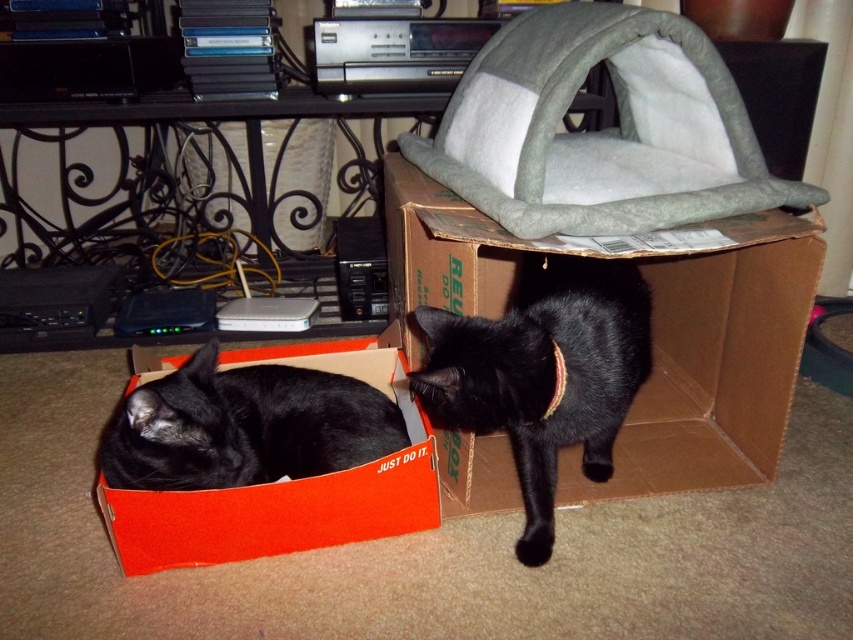
Question: Does cardboard box at center have a greater width compared to black smooth cat at lower left?

Choices:
 (A) yes
 (B) no

Answer: (A)

Question: Which point is closer to the camera?

Choices:
 (A) black smooth cat at lower left
 (B) cardboard box at center

Answer: (A)

Question: Which point appears farthest from the camera in this image?

Choices:
 (A) (425, 326)
 (B) (399, 275)
 (C) (277, 378)

Answer: (B)

Question: Does cardboard box at center come behind black fur cat at center?

Choices:
 (A) yes
 (B) no

Answer: (A)

Question: Can you confirm if black fur cat at center is thinner than black smooth cat at lower left?

Choices:
 (A) yes
 (B) no

Answer: (A)

Question: Which object is positioned farthest from the cardboard box at center?

Choices:
 (A) black smooth cat at lower left
 (B) black fur cat at center

Answer: (A)